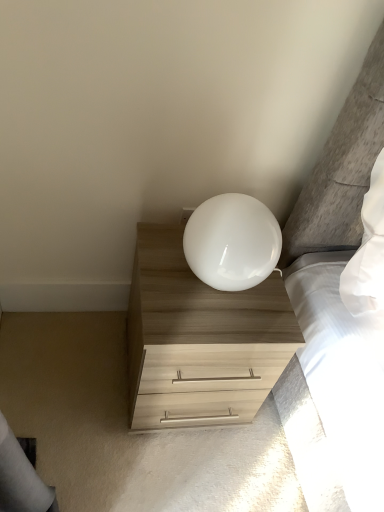
Question: Is white glossy lamp at upper center turned away from light wood/texture chest of drawers at lower right?

Choices:
 (A) yes
 (B) no

Answer: (B)

Question: Considering the relative sizes of white glossy lamp at upper center and light wood/texture chest of drawers at lower right in the image provided, is white glossy lamp at upper center shorter than light wood/texture chest of drawers at lower right?

Choices:
 (A) yes
 (B) no

Answer: (A)

Question: Is white glossy lamp at upper center smaller than light wood/texture chest of drawers at lower right?

Choices:
 (A) no
 (B) yes

Answer: (B)

Question: Is white glossy lamp at upper center outside light wood/texture chest of drawers at lower right?

Choices:
 (A) no
 (B) yes

Answer: (B)

Question: Can you confirm if white glossy lamp at upper center is wider than light wood/texture chest of drawers at lower right?

Choices:
 (A) no
 (B) yes

Answer: (A)

Question: Considering the relative sizes of white glossy lamp at upper center and light wood/texture chest of drawers at lower right in the image provided, is white glossy lamp at upper center bigger than light wood/texture chest of drawers at lower right?

Choices:
 (A) no
 (B) yes

Answer: (A)

Question: From a real-world perspective, is light wood/texture chest of drawers at lower right over white glossy lamp at upper center?

Choices:
 (A) yes
 (B) no

Answer: (B)

Question: Would you say light wood/texture chest of drawers at lower right is outside white glossy lamp at upper center?

Choices:
 (A) yes
 (B) no

Answer: (A)

Question: From the image's perspective, is light wood/texture chest of drawers at lower right over white glossy lamp at upper center?

Choices:
 (A) yes
 (B) no

Answer: (B)

Question: Is white glossy lamp at upper center at the back of light wood/texture chest of drawers at lower right?

Choices:
 (A) yes
 (B) no

Answer: (B)

Question: Does light wood/texture chest of drawers at lower right come in front of white glossy lamp at upper center?

Choices:
 (A) yes
 (B) no

Answer: (B)

Question: Does light wood/texture chest of drawers at lower right have a greater height compared to white glossy lamp at upper center?

Choices:
 (A) no
 (B) yes

Answer: (B)

Question: From a real-world perspective, is light wood/texture chest of drawers at lower right above or below white glossy lamp at upper center?

Choices:
 (A) above
 (B) below

Answer: (B)